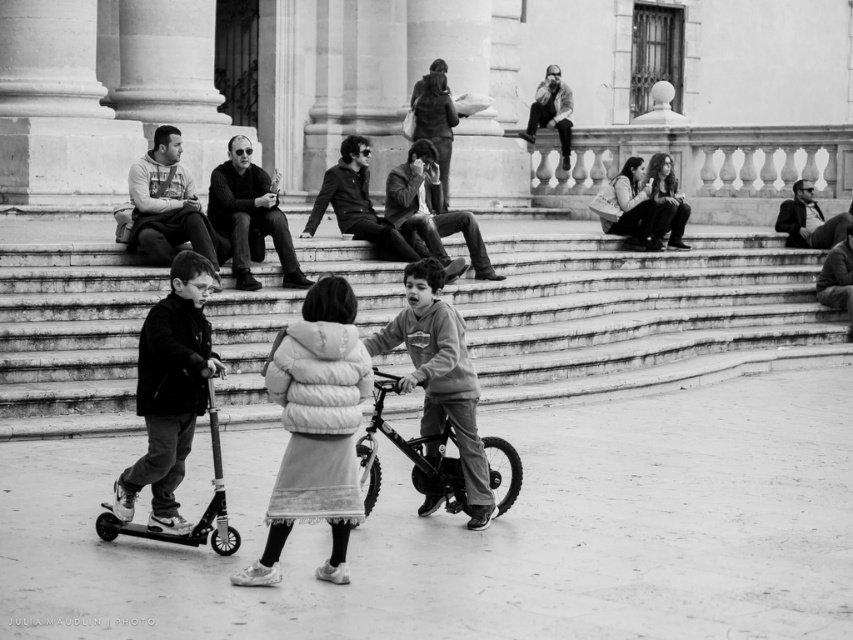
You are a photographer standing in front of the scene. You want to take a photo that includes both the white fluffy coat at center and the metallic silver bicycle at center. Which object will appear larger in your photo?

The white fluffy coat at center will appear larger in the photo because it is closer to the viewer than the metallic silver bicycle at center.

You are a photographer standing at the bottom of the smooth concrete stairs at center. You want to take a photo of the white fluffy coat at center. Which direction should you look to capture it in your shot?

The smooth concrete stairs at center is located above the white fluffy coat at center, so you should look downward to capture the white fluffy coat at center in your shot.

You are a photographer trying to capture a shot of the smooth concrete stairs at center and the dark gray fleece jacket at center. Which object should you focus on first if you want to include both in your frame without moving the camera?

The smooth concrete stairs at center is larger in size than the dark gray fleece jacket at center, so you should focus on the larger object first to ensure it fills the frame appropriately before adjusting for the smaller one.